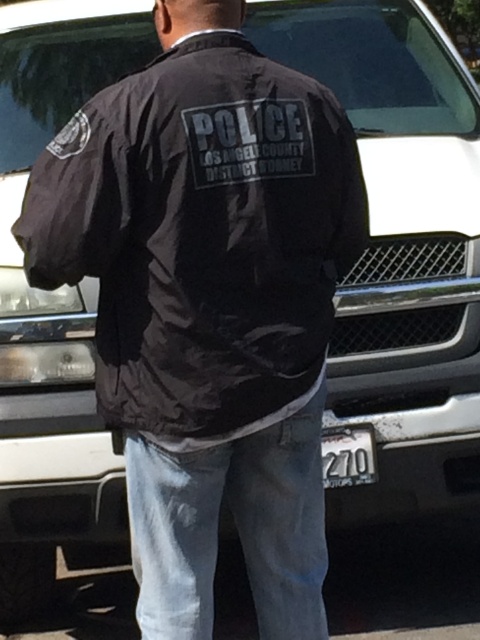
You are a security officer inspecting a vehicle and a person in a parking lot. You notice the black nylon jacket at center and the white plastic license plate at lower center. Which object is positioned higher in the scene?

The black nylon jacket at center is located above the white plastic license plate at lower center, so it is positioned higher in the scene.